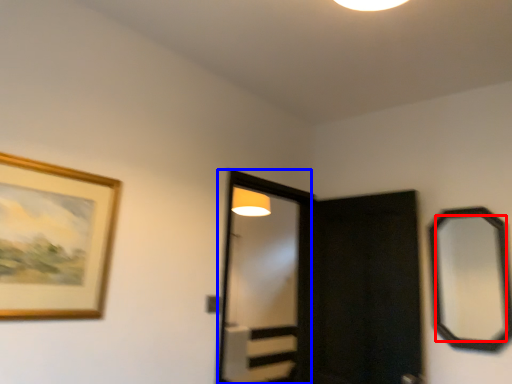
Question: Which object is closer to the camera taking this photo, mirror (highlighted by a red box) or screen door (highlighted by a blue box)?

Choices:
 (A) mirror
 (B) screen door

Answer: (A)